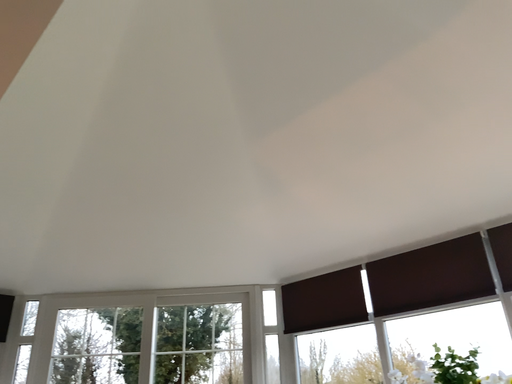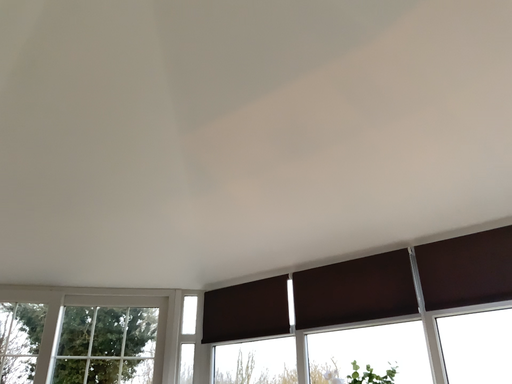
Question: How did the camera likely rotate when shooting the video?

Choices:
 (A) rotated right
 (B) rotated left

Answer: (A)